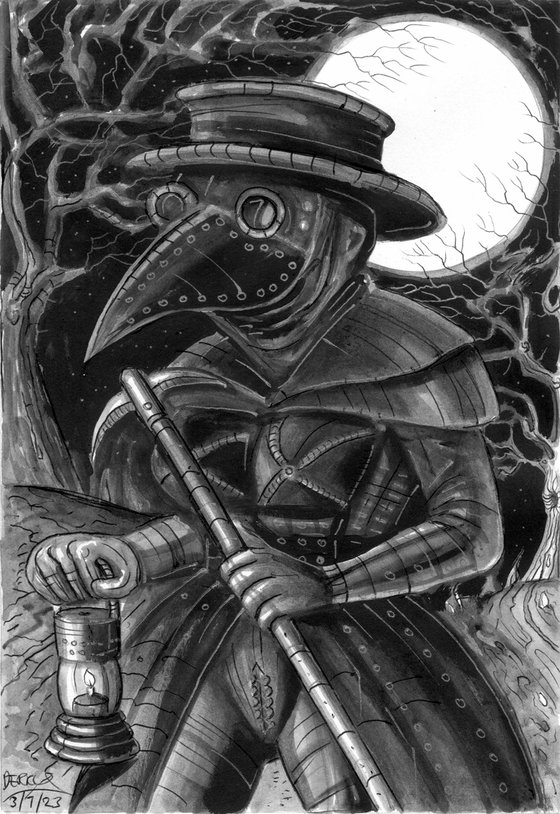
Identify the location of candle in lamp. (86, 677).